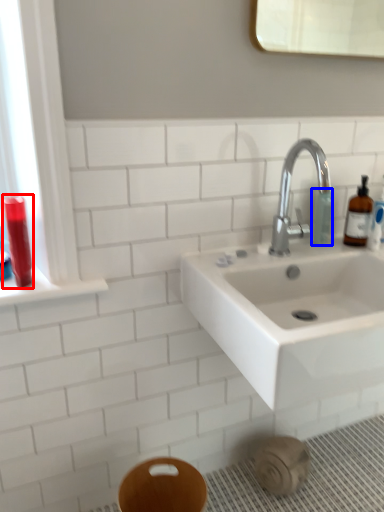
Question: Which object is closer to the camera taking this photo, mouthwash (highlighted by a red box) or toiletry (highlighted by a blue box)?

Choices:
 (A) mouthwash
 (B) toiletry

Answer: (A)